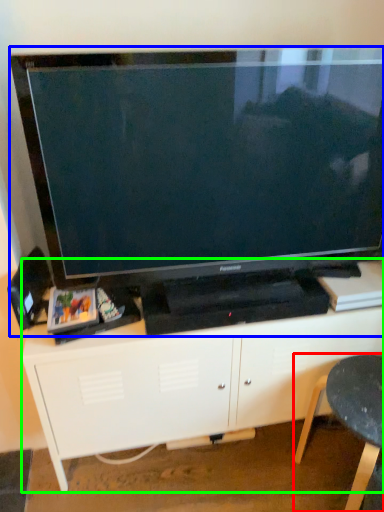
Question: Which object is the closest to the furniture (highlighted by a red box)? Choose among these: television (highlighted by a blue box) or entertainment center (highlighted by a green box).

Choices:
 (A) television
 (B) entertainment center

Answer: (B)